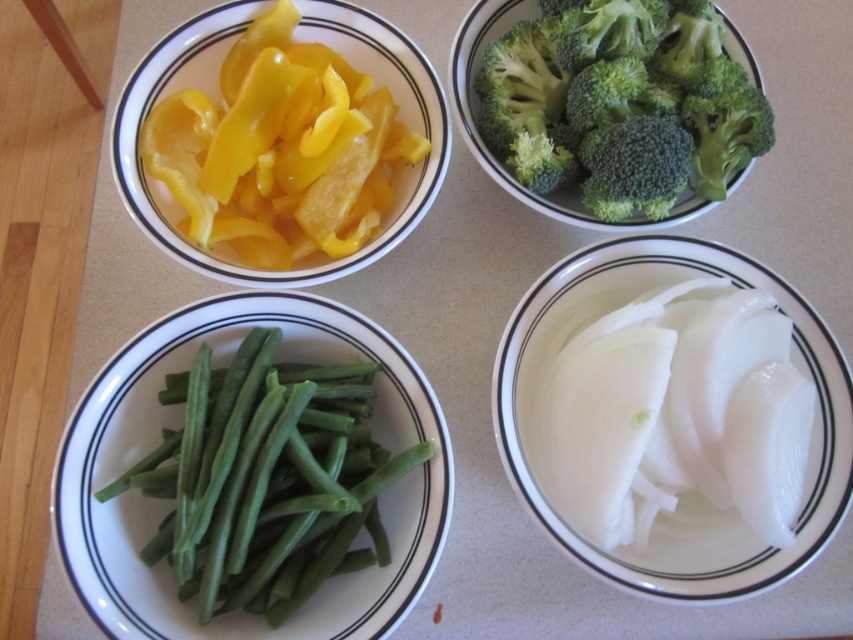
Is green matte green beans at lower left below green broccoli at upper center?

Correct, green matte green beans at lower left is located below green broccoli at upper center.

Between point (65, 484) and point (547, 214), which one is positioned behind?

The point (547, 214) is more distant.

Is point (115, 396) positioned before point (465, 65)?

Yes, point (115, 396) is in front of point (465, 65).

At what (x,y) coordinates should I click in order to perform the action: click on green matte green beans at lower left. Please return your answer as a coordinate pair (x, y). Looking at the image, I should click on (178, 422).

Who is positioned more to the right, green matte green beans at lower left or white translucent onion at lower right?

From the viewer's perspective, white translucent onion at lower right appears more on the right side.

Is green matte green beans at lower left taller than white translucent onion at lower right?

In fact, green matte green beans at lower left may be shorter than white translucent onion at lower right.

Describe the element at coordinates (178, 422) in the screenshot. I see `green matte green beans at lower left` at that location.

The height and width of the screenshot is (640, 853). I want to click on green matte green beans at lower left, so click(x=178, y=422).

Can you confirm if white translucent onion at lower right is wider than green broccoli at upper center?

In fact, white translucent onion at lower right might be narrower than green broccoli at upper center.

Is point (524, 456) more distant than point (473, 150)?

No, it is in front of (473, 150).

Where is `white translucent onion at lower right`? This screenshot has height=640, width=853. white translucent onion at lower right is located at coordinates (686, 515).